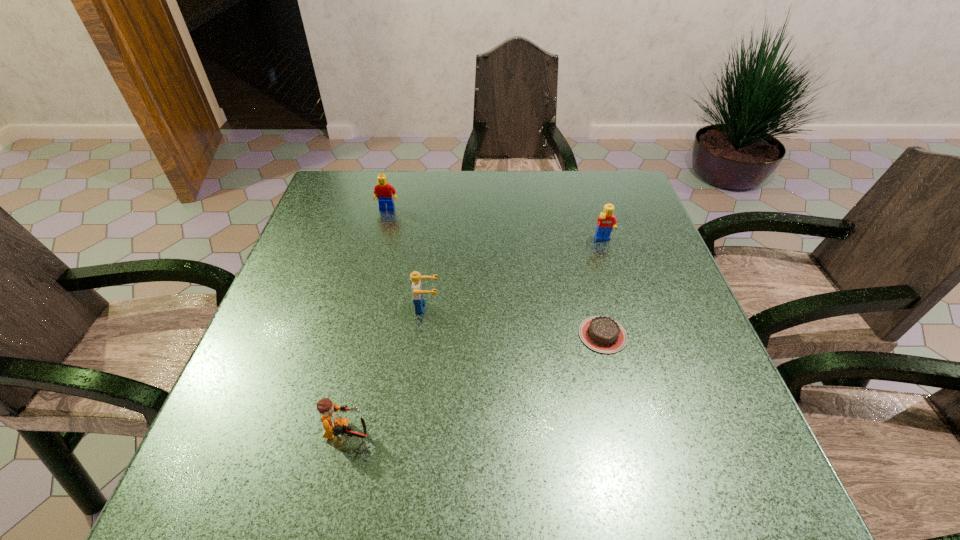
You are a GUI agent. You are given a task and a screenshot of the screen. Output one action in this format:
    pyautogui.click(x=<x>, y=<y>)
    Task: Click on the vacant space in between the third farthest object and the fourth farthest object
    This screenshot has height=540, width=960.
    Given the screenshot: What is the action you would take?
    pyautogui.click(x=515, y=321)

Locate which object ranks fourth in proximity to the farthest Lego. Please provide its 2D coordinates. Your answer should be formatted as a tuple, i.e. [(x, y)], where the tuple contains the x and y coordinates of a point satisfying the conditions above.

[(334, 425)]

Identify the location of object that can be found as the closest to the fourth nearest object. This screenshot has height=540, width=960. (602, 334).

This screenshot has height=540, width=960. Find the location of `Lego that can be found as the closest to the second Lego from right to left`. Lego that can be found as the closest to the second Lego from right to left is located at coordinates (334, 425).

Identify the location of Lego that is the third nearest to the third farthest Lego. (607, 221).

Locate an element on the screen. The width and height of the screenshot is (960, 540). vacant area in the image that satisfies the following two spatial constraints: 1. on the front-facing side of the fourth farthest object; 2. on the left side of the farthest object is located at coordinates (354, 335).

At what (x,y) coordinates should I click in order to perform the action: click on vacant space that satisfies the following two spatial constraints: 1. on the face of the third nearest Lego; 2. on the face of the third nearest object. Please return your answer as a coordinate pair (x, y). This screenshot has width=960, height=540. Looking at the image, I should click on (625, 307).